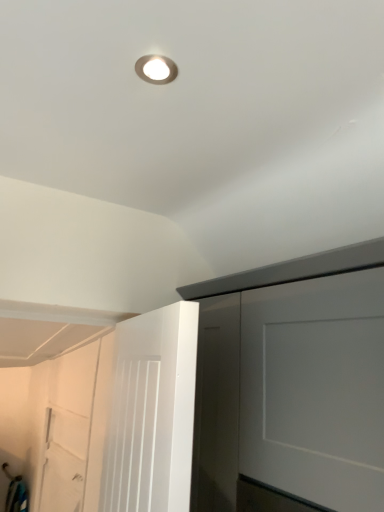
Question: Based on their sizes in the image, would you say matte silver droplight at upper center is bigger or smaller than white matte door at lower left?

Choices:
 (A) small
 (B) big

Answer: (A)

Question: From their relative heights in the image, would you say matte silver droplight at upper center is taller or shorter than white matte door at lower left?

Choices:
 (A) short
 (B) tall

Answer: (A)

Question: Which is farther from the matte silver droplight at upper center?

Choices:
 (A) white matte door at lower left
 (B) white matte door at lower left

Answer: (B)

Question: Considering the real-world distances, which object is closest to the white matte door at lower left?

Choices:
 (A) matte silver droplight at upper center
 (B) white matte door at lower left

Answer: (A)